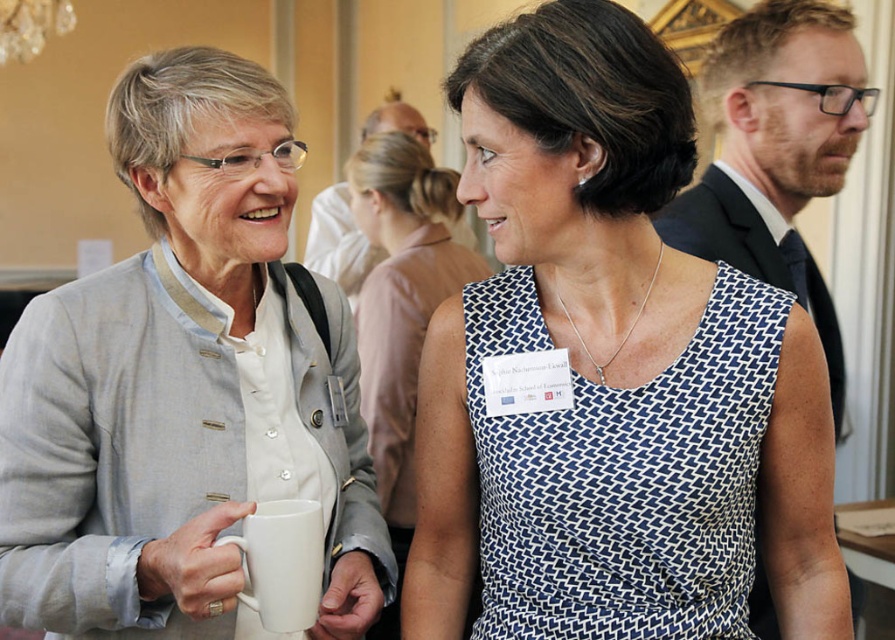
Question: Among these objects, which one is nearest to the camera?

Choices:
 (A) blue printed dress at center
 (B) white dotted dress at center
 (C) light gray fabric jacket at upper left
 (D) white matte mug at center

Answer: (D)

Question: Considering the relative positions of light gray fabric jacket at upper left and white dotted dress at center in the image provided, where is light gray fabric jacket at upper left located with respect to white dotted dress at center?

Choices:
 (A) left
 (B) right

Answer: (A)

Question: Is light gray fabric jacket at upper left positioned in front of white matte mug at center?

Choices:
 (A) no
 (B) yes

Answer: (A)

Question: Which point is farther from the camera taking this photo?

Choices:
 (A) (518, 42)
 (B) (260, 236)
 (C) (395, 179)

Answer: (C)

Question: Which point is closer to the camera?

Choices:
 (A) (330, 296)
 (B) (823, 474)

Answer: (B)

Question: Can you confirm if blue printed dress at center is positioned above light gray fabric jacket at upper left?

Choices:
 (A) no
 (B) yes

Answer: (A)